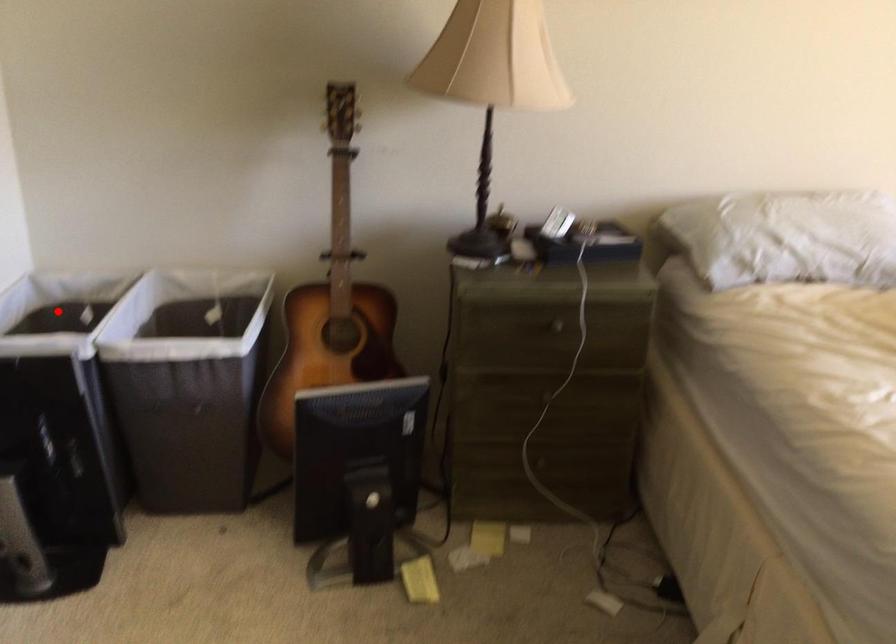
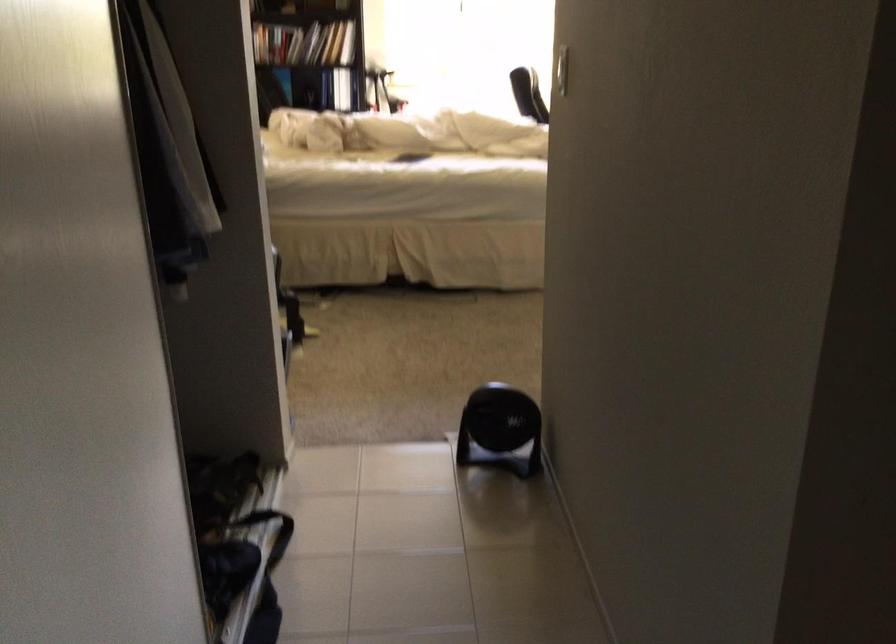
Question: I am providing you with two images of the same scene from different viewpoints. A red point is marked on the first image. Is the red point's position out of view in image 2?

Choices:
 (A) Yes
 (B) No

Answer: (A)